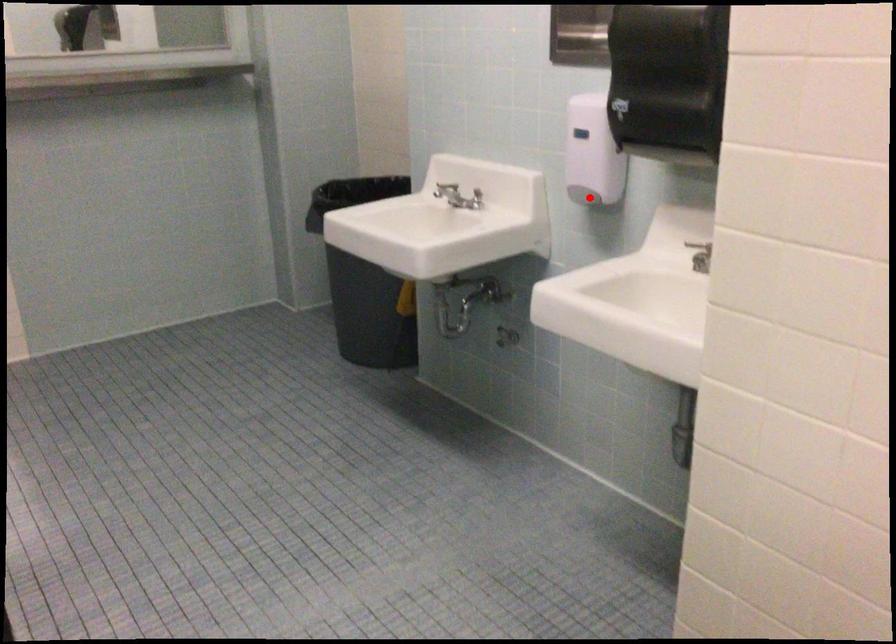
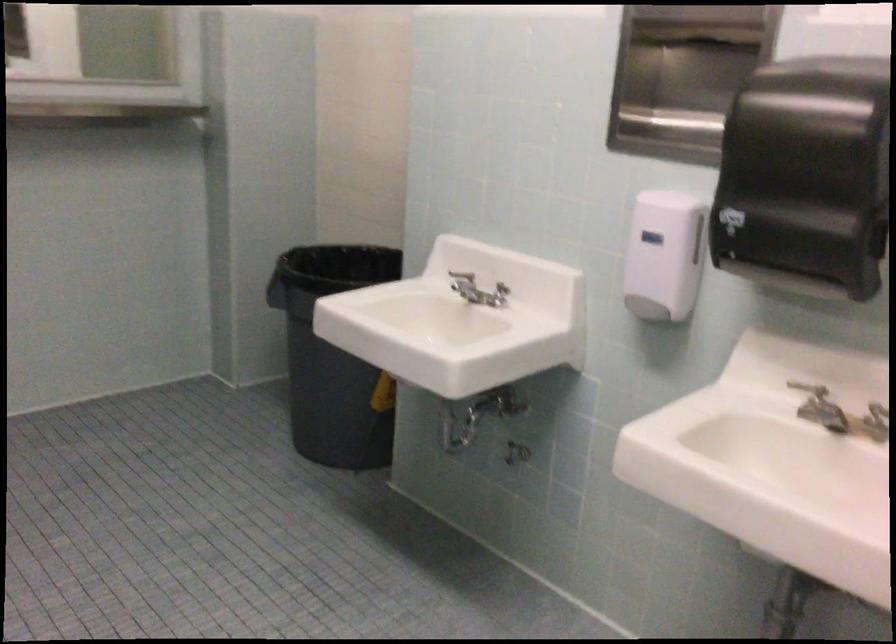
Question: A red point is marked in image1. In image2, is the corresponding 3D point closer to the camera or farther? Reply with the corresponding letter.

Choices:
 (A) The corresponding 3D point is closer.
 (B) The corresponding 3D point is farther.

Answer: (A)